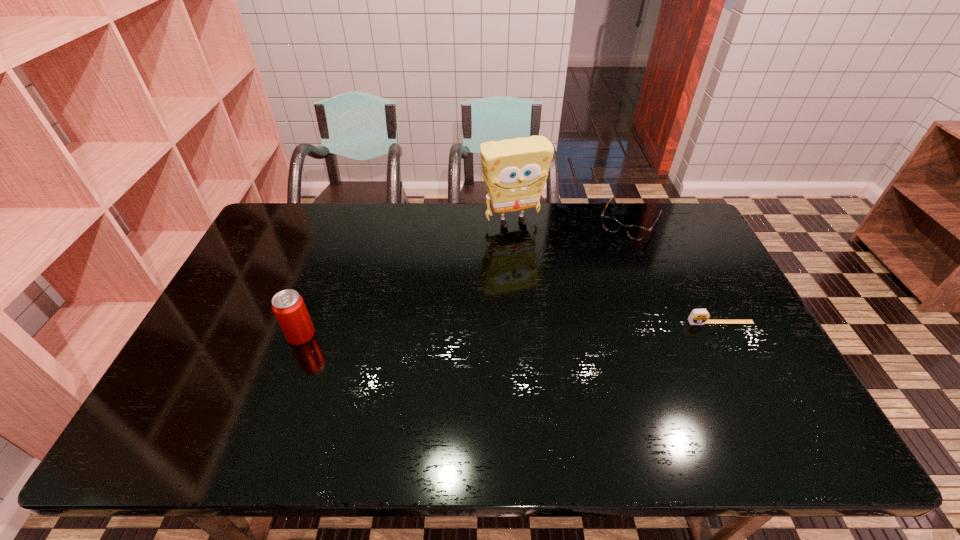
Find the location of `the leftmost object`. the leftmost object is located at coordinates click(288, 306).

In order to click on can in this screenshot , I will do `click(288, 306)`.

Where is `the shortest object`? The height and width of the screenshot is (540, 960). the shortest object is located at coordinates [x=698, y=316].

In order to click on sponge in this screenshot , I will do `click(515, 170)`.

What are the coordinates of `the tallest object` in the screenshot? It's located at (515, 170).

At what (x,y) coordinates should I click in order to perform the action: click on the second shortest object. Please return your answer as a coordinate pair (x, y). This screenshot has width=960, height=540. Looking at the image, I should click on pyautogui.click(x=610, y=224).

This screenshot has width=960, height=540. I want to click on vacant space located 0.280m on the back of the leftmost object, so click(x=329, y=258).

This screenshot has height=540, width=960. In order to click on vacant area situated at the front of the tape measure with the tape extended in this screenshot , I will do `click(750, 381)`.

Where is `free spot located on the face of the sponge`? The width and height of the screenshot is (960, 540). free spot located on the face of the sponge is located at coordinates (559, 302).

Find the location of a particular element. This screenshot has width=960, height=540. vacant region located 0.100m on the face of the sponge is located at coordinates (532, 253).